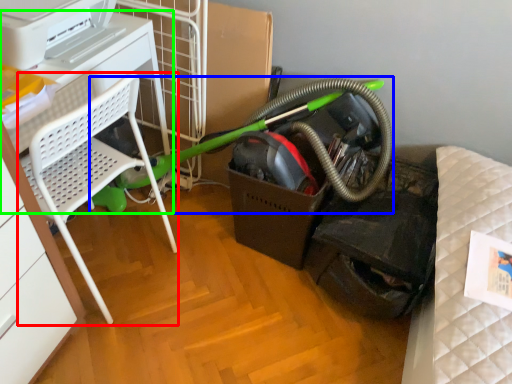
Question: Which object is the closest to the furniture (highlighted by a red box)? Choose among these: garden hose (highlighted by a blue box) or table (highlighted by a green box).

Choices:
 (A) garden hose
 (B) table

Answer: (B)